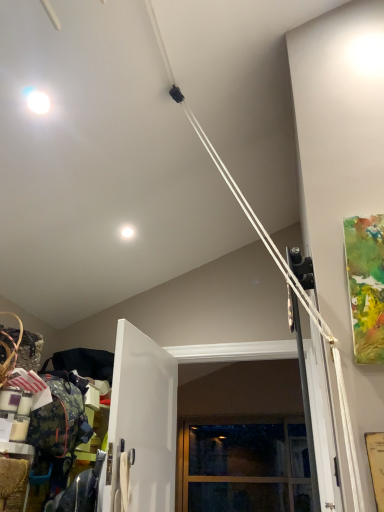
Question: From a real-world perspective, is clear glass window at center over white glossy door at center?

Choices:
 (A) no
 (B) yes

Answer: (A)

Question: Does clear glass window at center turn towards white glossy door at center?

Choices:
 (A) no
 (B) yes

Answer: (A)

Question: Can you confirm if clear glass window at center is bigger than white glossy door at center?

Choices:
 (A) no
 (B) yes

Answer: (B)

Question: Is the depth of clear glass window at center greater than that of white glossy door at center?

Choices:
 (A) no
 (B) yes

Answer: (B)

Question: Is clear glass window at center positioned with its back to white glossy door at center?

Choices:
 (A) yes
 (B) no

Answer: (B)

Question: Is clear glass window at center completely or partially outside of white glossy door at center?

Choices:
 (A) no
 (B) yes

Answer: (B)

Question: Is white glossy droplight at upper center not within clear glass window at center?

Choices:
 (A) no
 (B) yes

Answer: (B)

Question: Would you say white glossy droplight at upper center is a long distance from clear glass window at center?

Choices:
 (A) no
 (B) yes

Answer: (B)

Question: From the image's perspective, is white glossy droplight at upper center located beneath clear glass window at center?

Choices:
 (A) no
 (B) yes

Answer: (A)

Question: Are white glossy droplight at upper center and clear glass window at center beside each other?

Choices:
 (A) yes
 (B) no

Answer: (B)

Question: From a real-world perspective, is white glossy droplight at upper center on top of clear glass window at center?

Choices:
 (A) yes
 (B) no

Answer: (A)

Question: Is white glossy droplight at upper center facing away from clear glass window at center?

Choices:
 (A) no
 (B) yes

Answer: (A)

Question: Is white glossy door at center surrounding white glossy droplight at upper center?

Choices:
 (A) no
 (B) yes

Answer: (A)